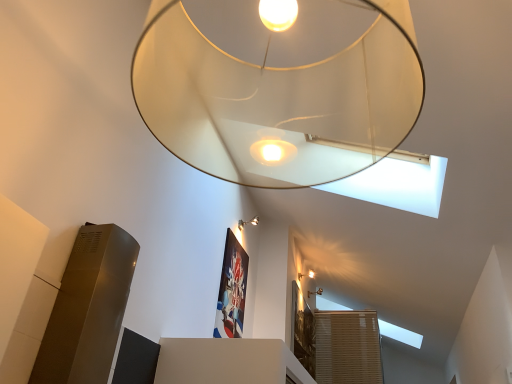
Question: Is matte gold wall sconce at upper right, acting as the third lamp starting from the top, looking in the opposite direction of translucent glass lampshade at upper center, which appears as the fourth lamp when viewed from the back?

Choices:
 (A) no
 (B) yes

Answer: (A)

Question: Is the surface of matte gold wall sconce at upper right, acting as the third lamp starting from the top, in direct contact with translucent glass lampshade at upper center, acting as the second lamp starting from the left?

Choices:
 (A) yes
 (B) no

Answer: (B)

Question: From a real-world perspective, is matte gold wall sconce at upper right, arranged as the 3th lamp when viewed from the front, on top of translucent glass lampshade at upper center, which appears as the fourth lamp when viewed from the back?

Choices:
 (A) yes
 (B) no

Answer: (A)

Question: Is matte gold wall sconce at upper right, arranged as the 3th lamp when viewed from the front, further to camera compared to translucent glass lampshade at upper center, which appears as the fourth lamp when viewed from the back?

Choices:
 (A) no
 (B) yes

Answer: (B)

Question: Considering the relative sizes of matte gold wall sconce at upper right, the second lamp in the bottom-to-top sequence, and translucent glass lampshade at upper center, acting as the second lamp starting from the left, in the image provided, is matte gold wall sconce at upper right, the second lamp in the bottom-to-top sequence, thinner than translucent glass lampshade at upper center, acting as the second lamp starting from the left,?

Choices:
 (A) yes
 (B) no

Answer: (A)

Question: In terms of height, does matte white lampshade at upper center, acting as the 4th lamp starting from the top, look taller or shorter compared to matte silver wall sconce at upper center, which ranks as the 3th lamp in back-to-front order?

Choices:
 (A) short
 (B) tall

Answer: (A)

Question: Considering the relative positions of matte white lampshade at upper center, the 4th lamp viewed from the front, and matte silver wall sconce at upper center, the third lamp ordered from the bottom, in the image provided, is matte white lampshade at upper center, the 4th lamp viewed from the front, to the left or to the right of matte silver wall sconce at upper center, the third lamp ordered from the bottom,?

Choices:
 (A) right
 (B) left

Answer: (A)

Question: Considering the positions of matte white lampshade at upper center, the 4th lamp viewed from the front, and matte silver wall sconce at upper center, the 2th lamp viewed from the top, in the image, is matte white lampshade at upper center, the 4th lamp viewed from the front, wider or thinner than matte silver wall sconce at upper center, the 2th lamp viewed from the top,?

Choices:
 (A) wide
 (B) thin

Answer: (B)

Question: Considering their positions, is matte white lampshade at upper center, which appears as the 1th lamp when viewed from the right, located in front of or behind matte silver wall sconce at upper center, which ranks as the 3th lamp in back-to-front order?

Choices:
 (A) behind
 (B) front

Answer: (A)

Question: Is matte silver wall sconce at upper center, the 2th lamp viewed from the top, taller or shorter than matte white lampshade at upper center, the 4th lamp viewed from the front?

Choices:
 (A) tall
 (B) short

Answer: (A)

Question: Is matte silver wall sconce at upper center, placed as the 4th lamp when sorted from right to left, spatially inside matte white lampshade at upper center, which is the first lamp from back to front, or outside of it?

Choices:
 (A) inside
 (B) outside

Answer: (B)

Question: Based on their sizes in the image, would you say matte silver wall sconce at upper center, which ranks as the 3th lamp in back-to-front order, is bigger or smaller than matte white lampshade at upper center, acting as the 4th lamp starting from the left?

Choices:
 (A) big
 (B) small

Answer: (A)

Question: Considering the relative positions of matte silver wall sconce at upper center, which ranks as the 3th lamp in back-to-front order, and matte white lampshade at upper center, placed as the first lamp when sorted from bottom to top, in the image provided, is matte silver wall sconce at upper center, which ranks as the 3th lamp in back-to-front order, to the left or to the right of matte white lampshade at upper center, placed as the first lamp when sorted from bottom to top,?

Choices:
 (A) right
 (B) left

Answer: (B)

Question: In terms of height, does matte gold wall sconce at upper right, arranged as the 3th lamp when viewed from the front, look taller or shorter compared to translucent glass lampshade at upper center, which appears as the fourth lamp when viewed from the back?

Choices:
 (A) tall
 (B) short

Answer: (B)

Question: Is matte gold wall sconce at upper right, arranged as the 3th lamp when viewed from the front, situated inside translucent glass lampshade at upper center, the 4th lamp ordered from the bottom, or outside?

Choices:
 (A) outside
 (B) inside

Answer: (A)